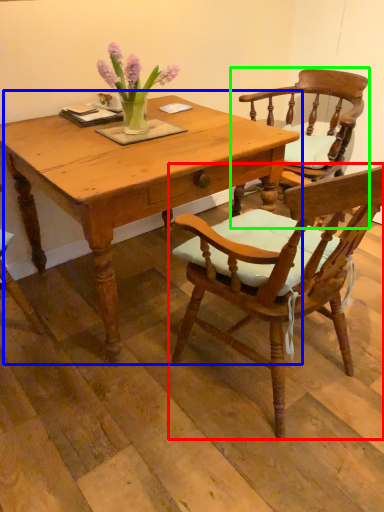
Question: Which object is positioned closest to chair (highlighted by a red box)? Select from table (highlighted by a blue box) and chair (highlighted by a green box).

Choices:
 (A) table
 (B) chair

Answer: (A)